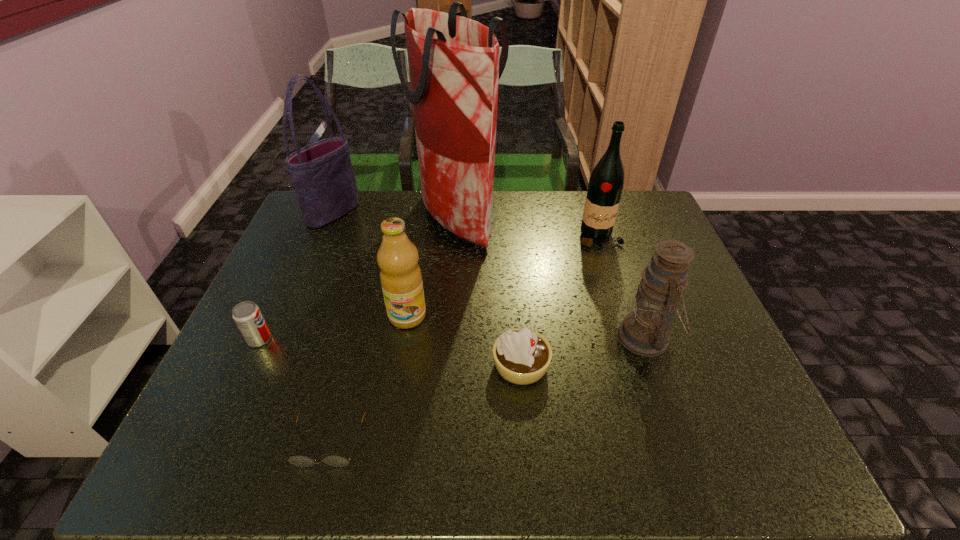
Locate an element on the screen. the tallest object is located at coordinates (454, 66).

You are a GUI agent. You are given a task and a screenshot of the screen. Output one action in this format:
    pyautogui.click(x=<x>, y=<y>)
    Task: Click on the tote bag
    
    Given the screenshot: What is the action you would take?
    pyautogui.click(x=322, y=174)

Identify the location of wine bottle. The height and width of the screenshot is (540, 960). (605, 187).

Identify the location of olive oil. This screenshot has height=540, width=960. (401, 279).

Where is `oil lamp`? The height and width of the screenshot is (540, 960). oil lamp is located at coordinates (645, 331).

Find the location of `soda`. soda is located at coordinates (247, 315).

Locate an element on the screen. This screenshot has width=960, height=540. whipped cream is located at coordinates (522, 356).

Where is `spectacles`? This screenshot has height=540, width=960. spectacles is located at coordinates (337, 461).

You are a GUI agent. You are given a task and a screenshot of the screen. Output one action in this format:
    pyautogui.click(x=<x>, y=<y>)
    Task: Click on the nearest object
    
    Given the screenshot: What is the action you would take?
    pyautogui.click(x=337, y=461)

The image size is (960, 540). What are the coordinates of `free region located on the right of the grocery bag` in the screenshot? It's located at (600, 221).